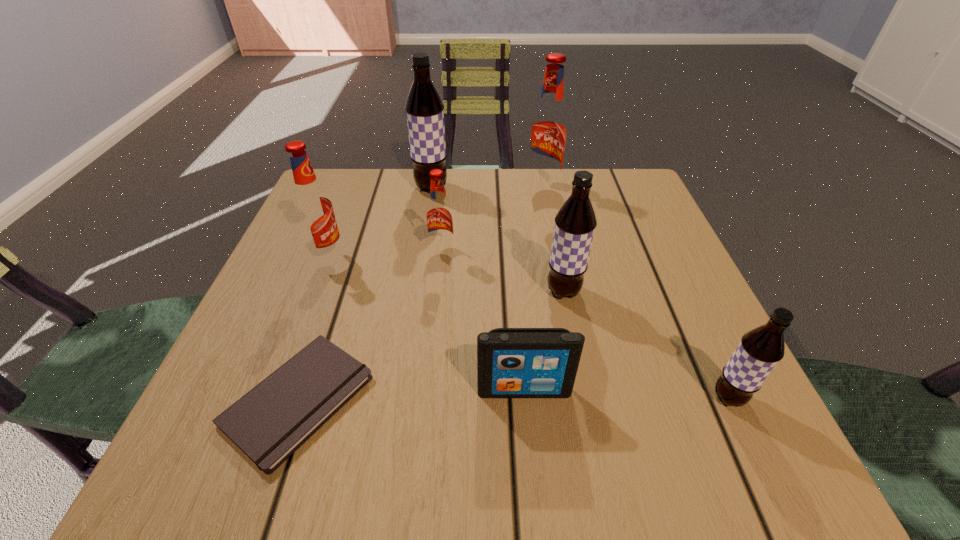
Where is `vacant area at the far left corner`? This screenshot has height=540, width=960. vacant area at the far left corner is located at coordinates (345, 177).

This screenshot has width=960, height=540. Identify the location of vacant position at the far right corner of the desktop. (622, 203).

Locate an element on the screen. This screenshot has height=540, width=960. blank space at the near right corner is located at coordinates (758, 457).

The image size is (960, 540). In order to click on free space between the smallest brown root beer and the shortest object in this screenshot , I will do `click(514, 399)`.

Where is `empty location between the rightmost object and the iPod`? empty location between the rightmost object and the iPod is located at coordinates (627, 394).

Find the location of a particular element. vacant space in between the nearest root beer and the iPod is located at coordinates (627, 394).

The height and width of the screenshot is (540, 960). I want to click on free space between the rightmost red root beer and the biggest brown root beer, so click(487, 187).

Identify the location of unoccupied position between the biggest brown root beer and the rightmost red root beer. (487, 187).

Locate an element on the screen. blank region between the second shortest object and the second smallest red root beer is located at coordinates (426, 323).

The image size is (960, 540). In order to click on free space between the checkbook and the leftmost red root beer in this screenshot , I will do `click(313, 328)`.